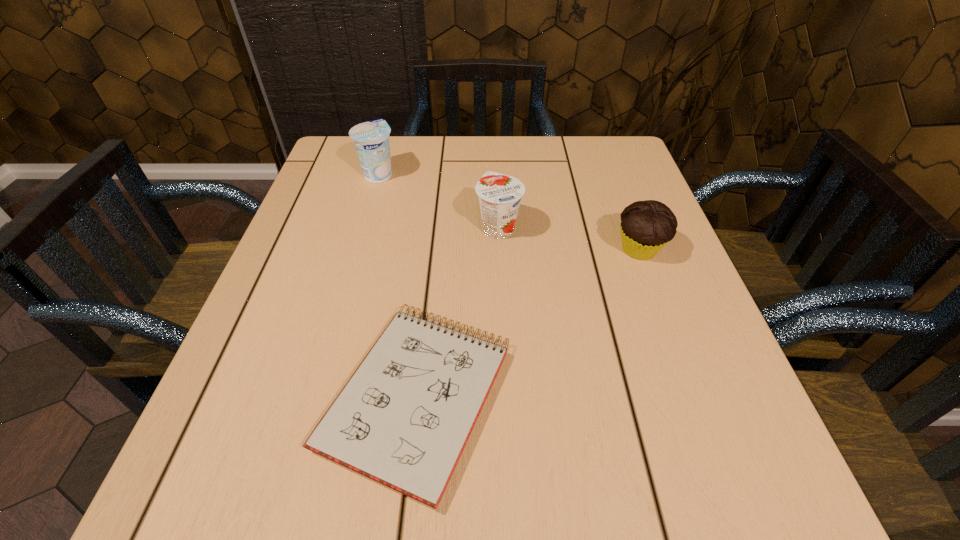
Find the location of a particular element. The height and width of the screenshot is (540, 960). the farther yogurt is located at coordinates (371, 139).

Identify the location of the farthest object. (371, 139).

The height and width of the screenshot is (540, 960). In order to click on the nearer yogurt in this screenshot , I will do `click(499, 195)`.

The height and width of the screenshot is (540, 960). In order to click on muffin in this screenshot , I will do `click(646, 226)`.

Identify the location of the shortest object. This screenshot has width=960, height=540. (403, 419).

The height and width of the screenshot is (540, 960). Find the location of `the nearest object`. the nearest object is located at coordinates (403, 419).

Where is `free spot located on the right of the farther yogurt`? The width and height of the screenshot is (960, 540). free spot located on the right of the farther yogurt is located at coordinates (482, 174).

Locate an element on the screen. The image size is (960, 540). free point located 0.350m on the front of the nearer yogurt is located at coordinates (506, 398).

Where is `vacant space situated on the back of the muffin`? vacant space situated on the back of the muffin is located at coordinates (607, 162).

I want to click on free region located 0.080m on the right of the notepad, so click(564, 396).